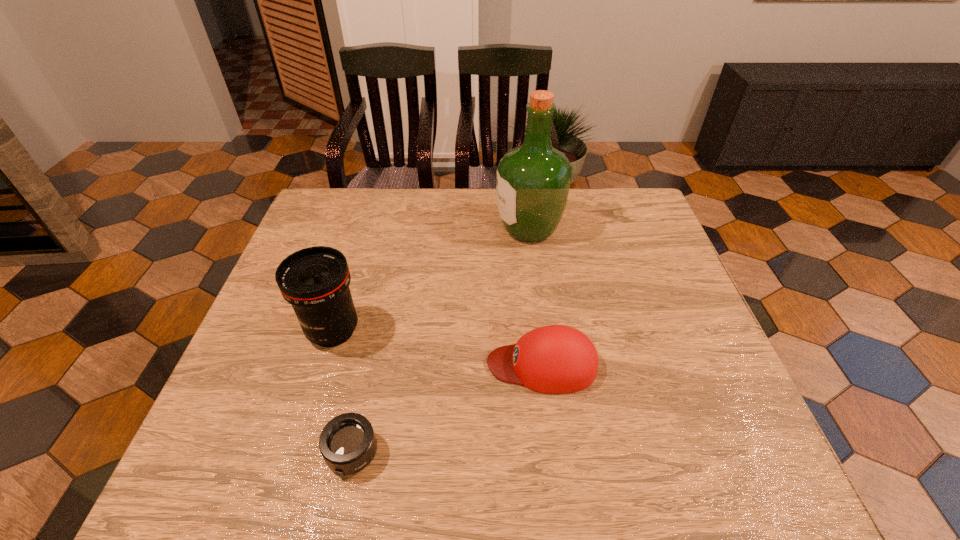
Where is `vacant space positioned 0.280m on the front of the third shortest object`? The width and height of the screenshot is (960, 540). vacant space positioned 0.280m on the front of the third shortest object is located at coordinates (287, 484).

The image size is (960, 540). I want to click on free location located 0.200m on the front-facing side of the second shortest object, so click(x=396, y=364).

The height and width of the screenshot is (540, 960). What are the coordinates of `free space located on the front-facing side of the second shortest object` in the screenshot? It's located at (401, 364).

Locate an element on the screen. Image resolution: width=960 pixels, height=540 pixels. vacant space positioned 0.270m on the front-facing side of the second shortest object is located at coordinates (365, 364).

Locate an element on the screen. object at the far edge is located at coordinates (533, 180).

I want to click on object present at the near edge, so click(347, 443).

The height and width of the screenshot is (540, 960). I want to click on object that is at the left edge, so click(315, 281).

Where is `vacant region at the far edge of the desktop`? Image resolution: width=960 pixels, height=540 pixels. vacant region at the far edge of the desktop is located at coordinates (584, 206).

Identify the location of vacant point at the near edge. (661, 441).

The image size is (960, 540). In the image, there is a desktop. Find the location of `vacant space at the left edge`. vacant space at the left edge is located at coordinates (348, 247).